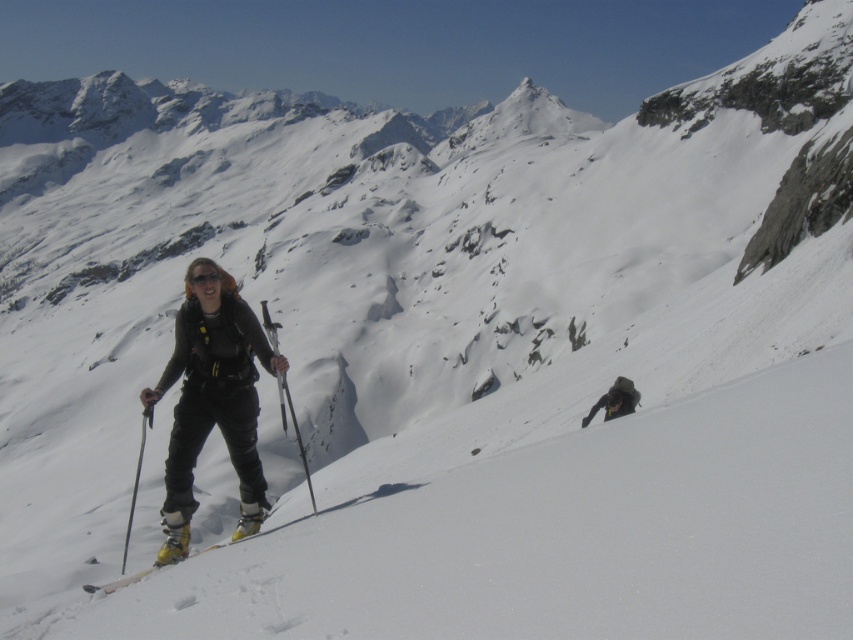
Between point (587, 416) and point (144, 573), which one is positioned in front?

Point (144, 573) is in front.

Does point (630, 385) come farther from viewer compared to point (107, 582)?

Yes, it is.

Which is behind, point (584, 419) or point (126, 580)?

Point (584, 419)

The width and height of the screenshot is (853, 640). Identify the location of dark green jacket at lower right. (614, 401).

Between white snow ski slope at center and yellow matte ski at center, which one appears on the right side from the viewer's perspective?

Positioned to the right is white snow ski slope at center.

Who is more distant from viewer, [842,429] or [142,573]?

Point [142,573]

Locate an element on the screen. The height and width of the screenshot is (640, 853). white snow ski slope at center is located at coordinates (540, 528).

What do you see at coordinates (212, 403) in the screenshot? Image resolution: width=853 pixels, height=640 pixels. I see `matte black ski suit at center` at bounding box center [212, 403].

Does matte black ski suit at center appear over matte black ski pole at center?

No, matte black ski suit at center is not above matte black ski pole at center.

At what (x,y) coordinates should I click in order to perform the action: click on matte black ski suit at center. Please return your answer as a coordinate pair (x, y). The width and height of the screenshot is (853, 640). Looking at the image, I should click on (212, 403).